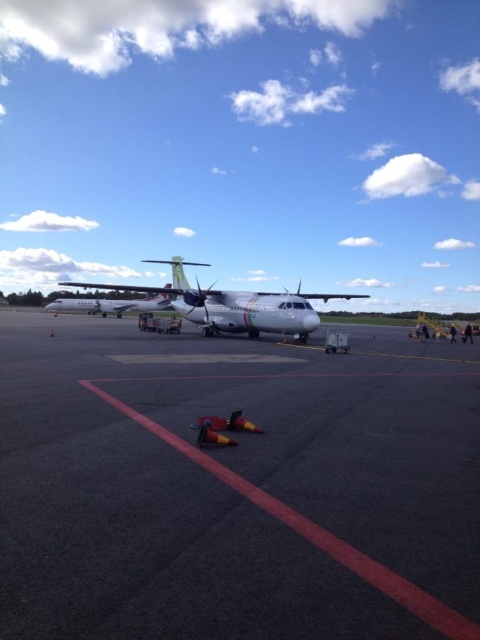
You are a maintenance worker who needs to reach the white matte airplane at center from the black asphalt tarmac at center. Can you walk directly to the airplane without needing to go around any obstacles?

The distance between the black asphalt tarmac at center and the white matte airplane at center is 18.82 meters, so yes, you can walk directly to the airplane without needing to go around any obstacles since there are no mentioned obstacles in the scene description.